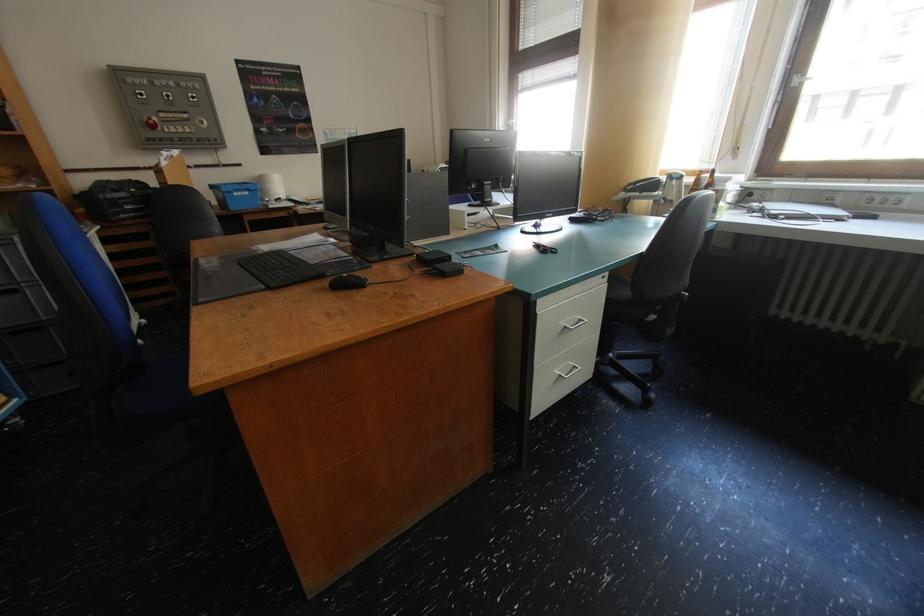
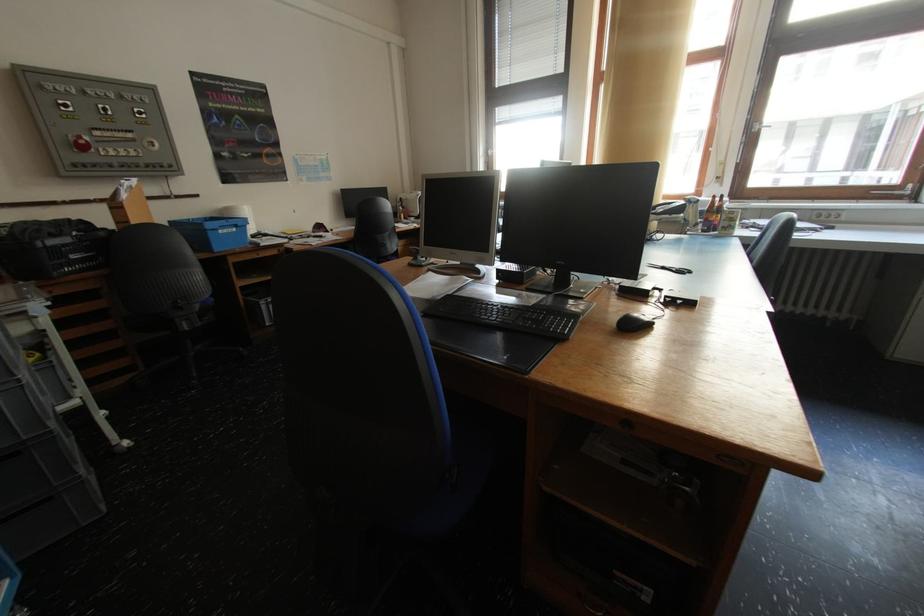
In the second image, find the point that corresponds to the point at 707,180 in the first image.

(721, 205)